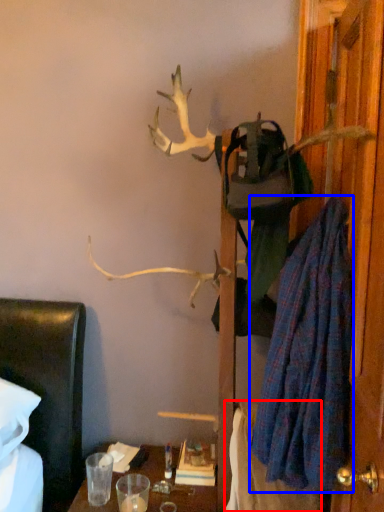
Question: Which point is closer to the camera, blanket (highlighted by a red box) or robe (highlighted by a blue box)?

Choices:
 (A) blanket
 (B) robe

Answer: (B)